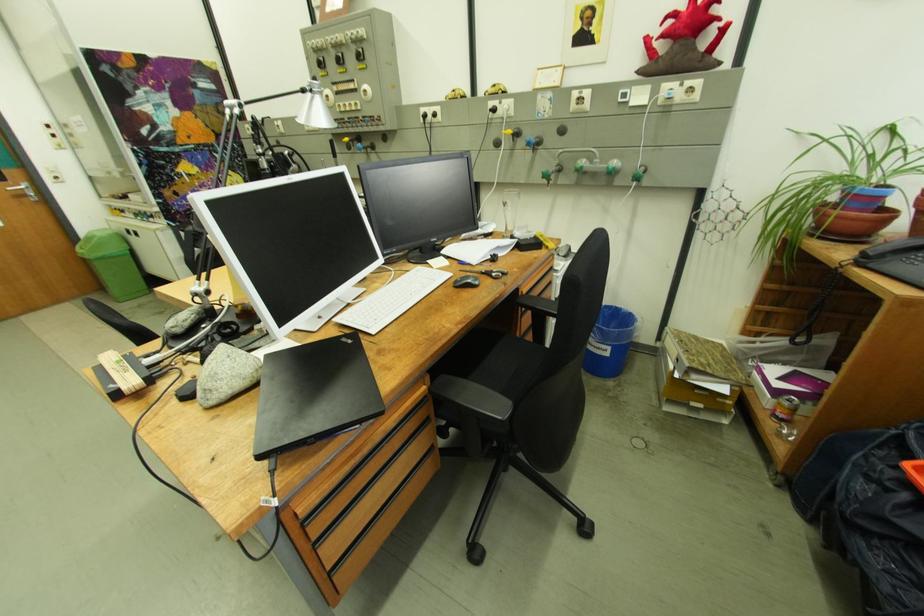
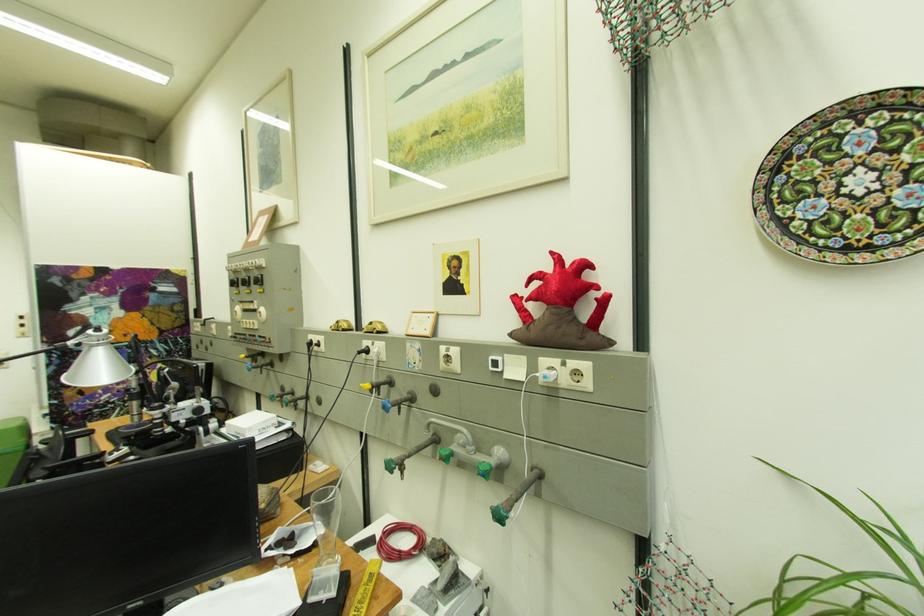
Find the pixel in the second image that matches (x=690, y=84) in the first image.

(575, 365)